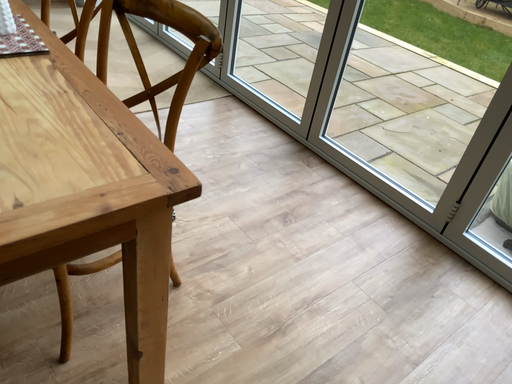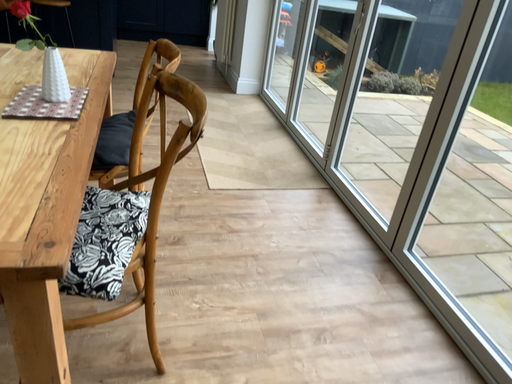
Question: How did the camera likely rotate when shooting the video?

Choices:
 (A) rotated right
 (B) rotated left

Answer: (B)